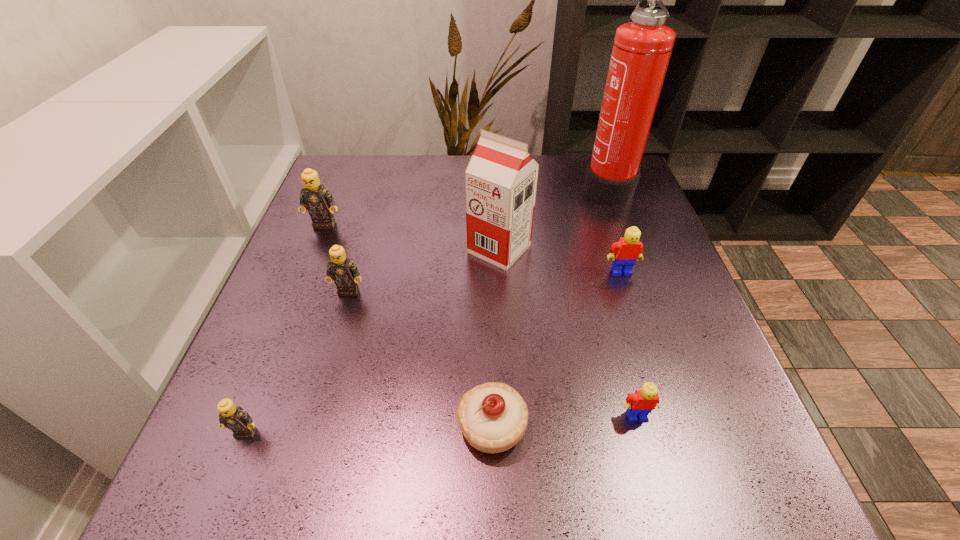
You are a GUI agent. You are given a task and a screenshot of the screen. Output one action in this format:
    pyautogui.click(x=<x>, y=<y>)
    Task: Click on the fire extinguisher
    Image resolution: width=960 pixels, height=540 pixels.
    Given the screenshot: What is the action you would take?
    pyautogui.click(x=641, y=51)

Find the location of a particular element. This screenshot has width=960, height=540. red fire extinguisher is located at coordinates (641, 51).

I want to click on soya milk, so click(x=501, y=178).

Identify the location of the biggest tan Lego. This screenshot has width=960, height=540. (318, 200).

Find the location of a particular element. the farthest tan Lego is located at coordinates (318, 200).

Identify the location of the bigger yellow Lego. The image size is (960, 540). (625, 252).

This screenshot has height=540, width=960. Identify the location of the fourth nearest Lego. (625, 252).

Find the location of a particular element. the third Lego from left to right is located at coordinates click(341, 269).

Find the location of a particular element. The height and width of the screenshot is (540, 960). the second biggest tan Lego is located at coordinates (341, 269).

The width and height of the screenshot is (960, 540). In order to click on the nearer yellow Lego in this screenshot , I will do `click(642, 402)`.